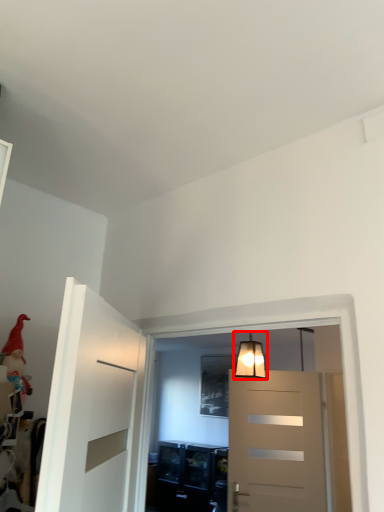
Question: Observing the image, what is the correct spatial positioning of lamp (annotated by the red box) in reference to toy?

Choices:
 (A) left
 (B) right

Answer: (B)